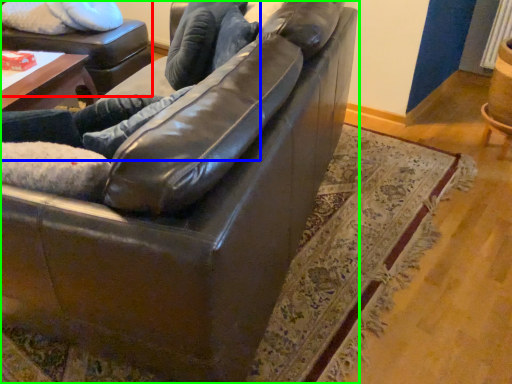
Question: Which object is the closest to the swivel chair (highlighted by a red box)? Choose among these: couple (highlighted by a blue box) or studio couch (highlighted by a green box).

Choices:
 (A) couple
 (B) studio couch

Answer: (A)